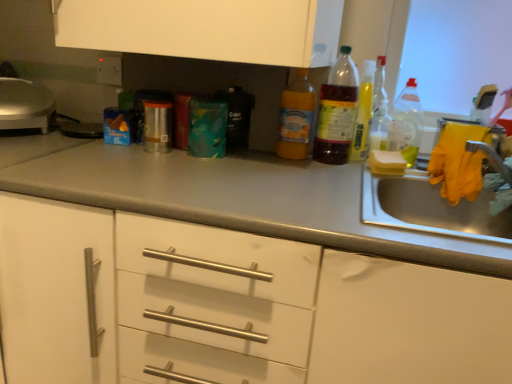
The width and height of the screenshot is (512, 384). I want to click on vacant area that lies to the right of white sponge at sink, so click(432, 176).